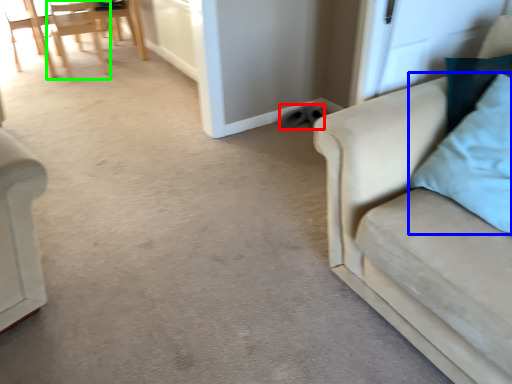
Question: Considering the real-world distances, which object is closest to footwear (highlighted by a red box)? pillow (highlighted by a blue box) or chair (highlighted by a green box).

Choices:
 (A) pillow
 (B) chair

Answer: (A)